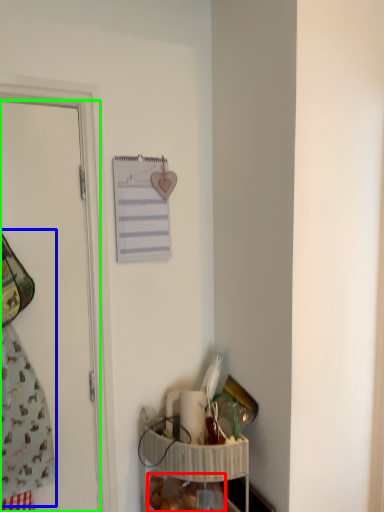
Question: Estimate the real-world distances between objects in this image. Which object is closer to food (highlighted by a red box), laundry (highlighted by a blue box) or door (highlighted by a green box)?

Choices:
 (A) laundry
 (B) door

Answer: (A)